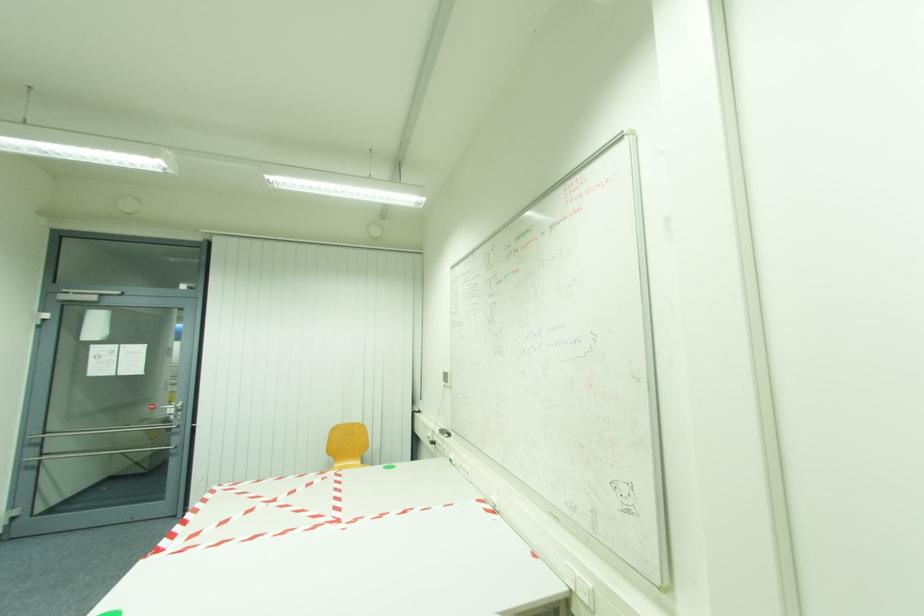
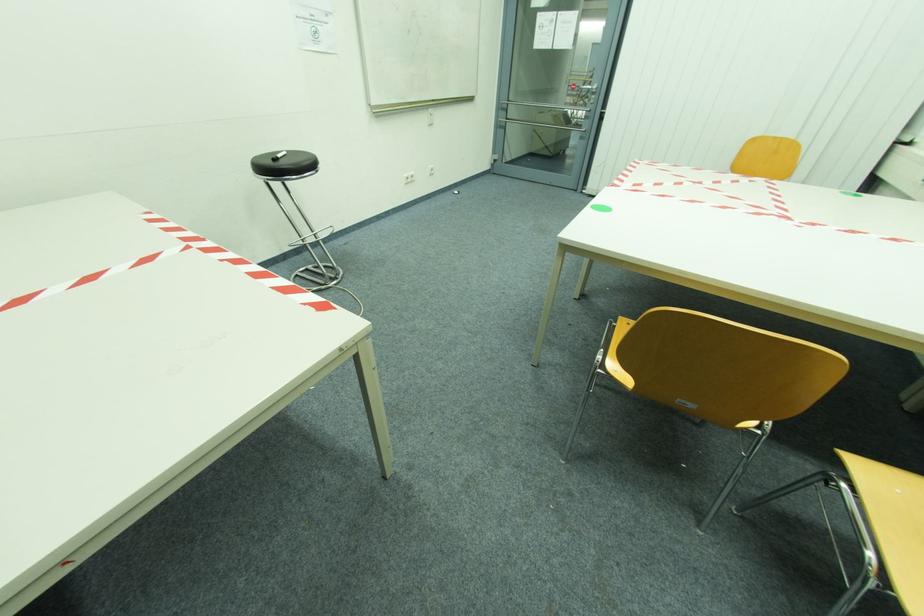
Looking at this image, the images are taken continuously from a first-person perspective. In which direction is your viewpoint rotating?

The camera rotated toward left-down.